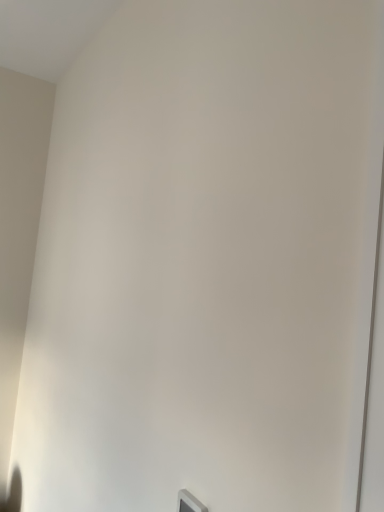
Measure the distance between point (x=189, y=502) and camera.

Point (x=189, y=502) is 85.80 centimeters away from camera.

Identify the location of white plastic light switch at lower right. This screenshot has width=384, height=512. (189, 502).

Describe the element at coordinates (189, 502) in the screenshot. I see `white plastic light switch at lower right` at that location.

What are the coordinates of `white plastic light switch at lower right` in the screenshot? It's located at (189, 502).